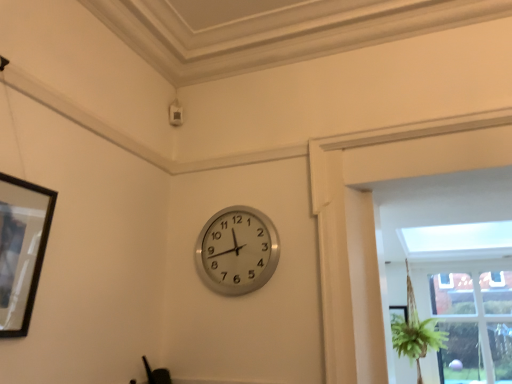
Question: Is silver metallic clock at center further to camera compared to black matte picture frame at left?

Choices:
 (A) no
 (B) yes

Answer: (B)

Question: Can you confirm if silver metallic clock at center is positioned to the right of black matte picture frame at left?

Choices:
 (A) yes
 (B) no

Answer: (A)

Question: Is silver metallic clock at center aimed at black matte picture frame at left?

Choices:
 (A) no
 (B) yes

Answer: (B)

Question: Can you confirm if silver metallic clock at center is wider than black matte picture frame at left?

Choices:
 (A) no
 (B) yes

Answer: (A)

Question: Is silver metallic clock at center smaller than black matte picture frame at left?

Choices:
 (A) no
 (B) yes

Answer: (B)

Question: From the image's perspective, is silver metallic clock at center above or below black matte picture frame at left?

Choices:
 (A) above
 (B) below

Answer: (B)

Question: Considering the positions of point (263, 283) and point (15, 228), is point (263, 283) closer or farther from the camera than point (15, 228)?

Choices:
 (A) farther
 (B) closer

Answer: (A)

Question: Considering the relative positions of silver metallic clock at center and black matte picture frame at left in the image provided, is silver metallic clock at center to the left or to the right of black matte picture frame at left?

Choices:
 (A) left
 (B) right

Answer: (B)

Question: Is silver metallic clock at center spatially inside black matte picture frame at left, or outside of it?

Choices:
 (A) outside
 (B) inside

Answer: (A)

Question: Looking at the image, does clear glass window at center right seem bigger or smaller compared to black matte picture frame at left?

Choices:
 (A) big
 (B) small

Answer: (A)

Question: Considering the positions of point click(440, 292) and point click(4, 248), is point click(440, 292) closer or farther from the camera than point click(4, 248)?

Choices:
 (A) closer
 (B) farther

Answer: (B)

Question: Based on their positions, is clear glass window at center right located to the left or right of black matte picture frame at left?

Choices:
 (A) right
 (B) left

Answer: (A)

Question: From a real-world perspective, relative to black matte picture frame at left, is clear glass window at center right vertically above or below?

Choices:
 (A) below
 (B) above

Answer: (A)

Question: From a real-world perspective, relative to clear glass window at center right, is black matte picture frame at left vertically above or below?

Choices:
 (A) above
 (B) below

Answer: (A)

Question: Choose the correct answer: Is black matte picture frame at left inside clear glass window at center right or outside it?

Choices:
 (A) outside
 (B) inside

Answer: (A)